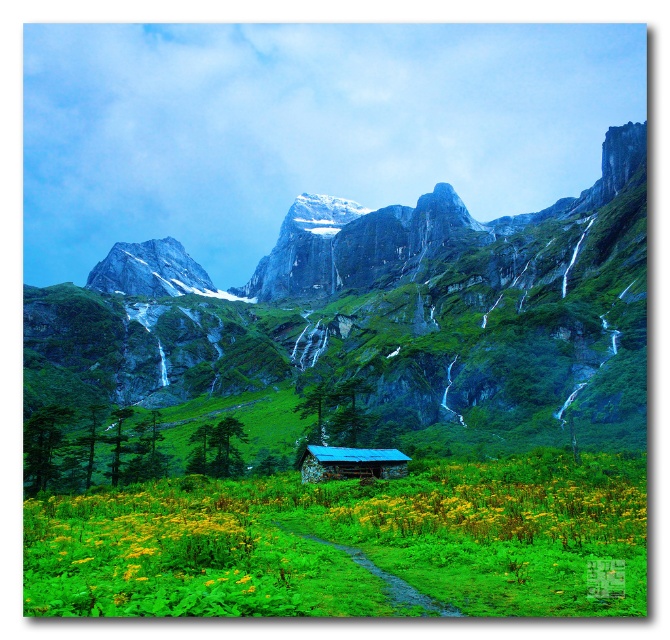
Question: Which object is positioned closest to the green grassy path at center?

Choices:
 (A) green grassy field at lower center
 (B) yellow matte flower at lower center
 (C) rustic wooden cabin at center

Answer: (B)

Question: Observing the image, what is the correct spatial positioning of green grassy field at lower center in reference to rustic wooden cabin at center?

Choices:
 (A) right
 (B) left

Answer: (B)

Question: Among these objects, which one is nearest to the camera?

Choices:
 (A) yellow matte flower at lower center
 (B) rustic wooden cabin at center

Answer: (A)

Question: Can you confirm if green grassy field at lower center is smaller than rustic wooden cabin at center?

Choices:
 (A) no
 (B) yes

Answer: (A)

Question: Is green grassy field at lower center smaller than yellow matte flower at lower center?

Choices:
 (A) no
 (B) yes

Answer: (A)

Question: Which object is the farthest from the green grassy path at center?

Choices:
 (A) rustic wooden cabin at center
 (B) green grassy field at lower center
 (C) yellow matte flower at lower center

Answer: (B)